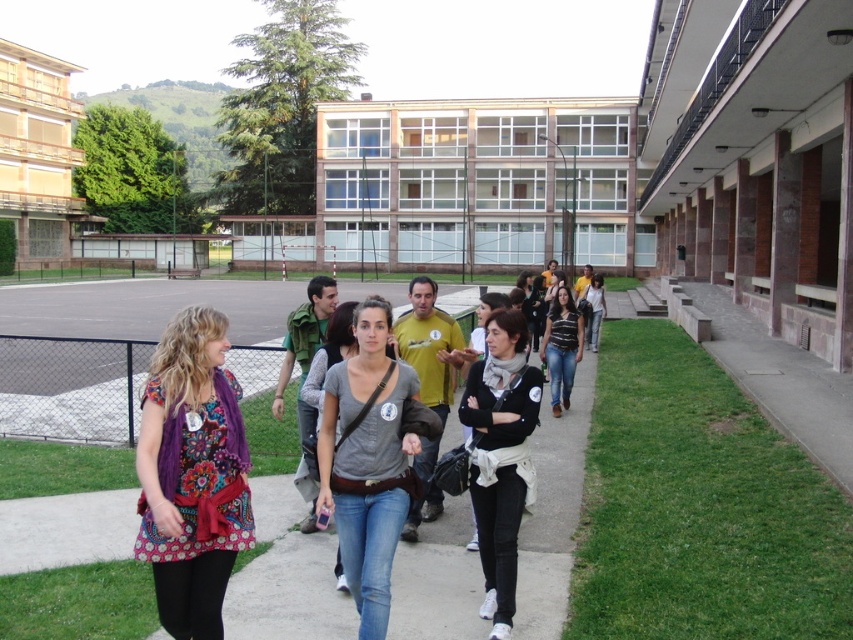
Between jeans at center and floral print dress at center, which one has less height?

Standing shorter between the two is floral print dress at center.

Which is more to the left, jeans at center or floral print dress at center?

From the viewer's perspective, jeans at center appears more on the left side.

Who is more distant from viewer, (454, 410) or (202, 636)?

The point (454, 410) is more distant.

This screenshot has width=853, height=640. Identify the location of jeans at center. (286, 577).

Does jeans at center have a lesser height compared to black matte jacket at center?

No.

Identify the location of jeans at center. (286, 577).

Measure the distance between point (207, 300) and camera.

32.73 meters

Where is `jeans at center`? This screenshot has width=853, height=640. jeans at center is located at coordinates (286, 577).

Does gray cotton t-shirt at center appear under black matte jacket at center?

No.

You are a GUI agent. You are given a task and a screenshot of the screen. Output one action in this format:
    pyautogui.click(x=<x>, y=<y>)
    Task: Click on the gray cotton t-shirt at center
    
    Given the screenshot: What is the action you would take?
    pyautogui.click(x=367, y=461)

Image resolution: width=853 pixels, height=640 pixels. I want to click on gray cotton t-shirt at center, so click(x=367, y=461).